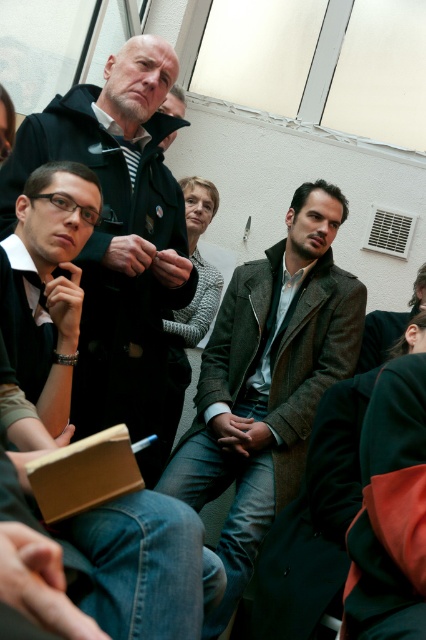
Question: Which is farther from the dark gray wool coat at center?

Choices:
 (A) brown woolen coat at center
 (B) matte black jacket at center

Answer: (A)

Question: Among these objects, which one is farthest from the camera?

Choices:
 (A) matte black jacket at center
 (B) brown woolen coat at center
 (C) dark gray wool coat at center

Answer: (C)

Question: Is brown woolen coat at center thinner than matte black jacket at center?

Choices:
 (A) yes
 (B) no

Answer: (B)

Question: Which point is farther to the camera?

Choices:
 (A) (83, 202)
 (B) (152, 413)

Answer: (B)

Question: Observing the image, what is the correct spatial positioning of brown woolen coat at center in reference to matte black jacket at center?

Choices:
 (A) below
 (B) above

Answer: (A)

Question: Where is brown woolen coat at center located in relation to matte black jacket at center in the image?

Choices:
 (A) left
 (B) right

Answer: (B)